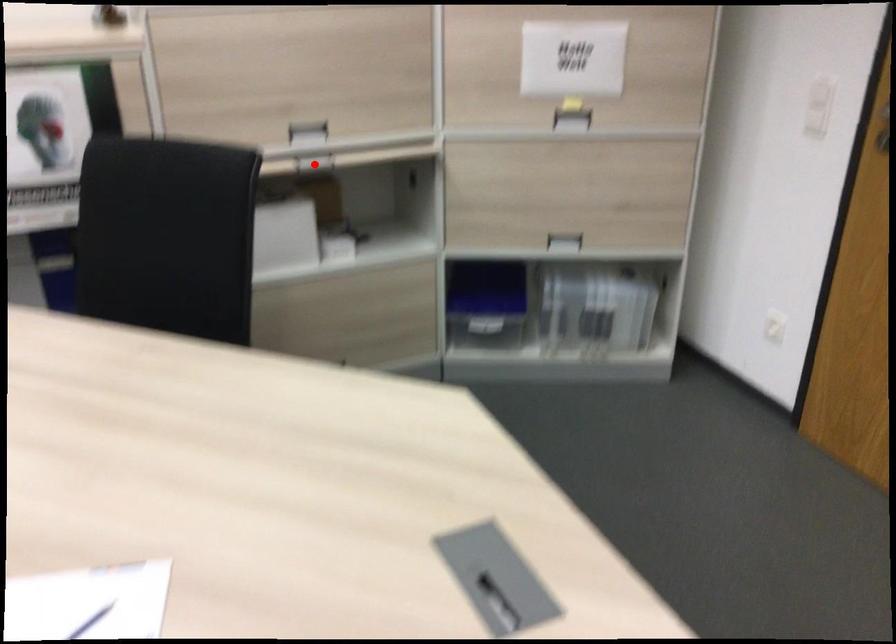
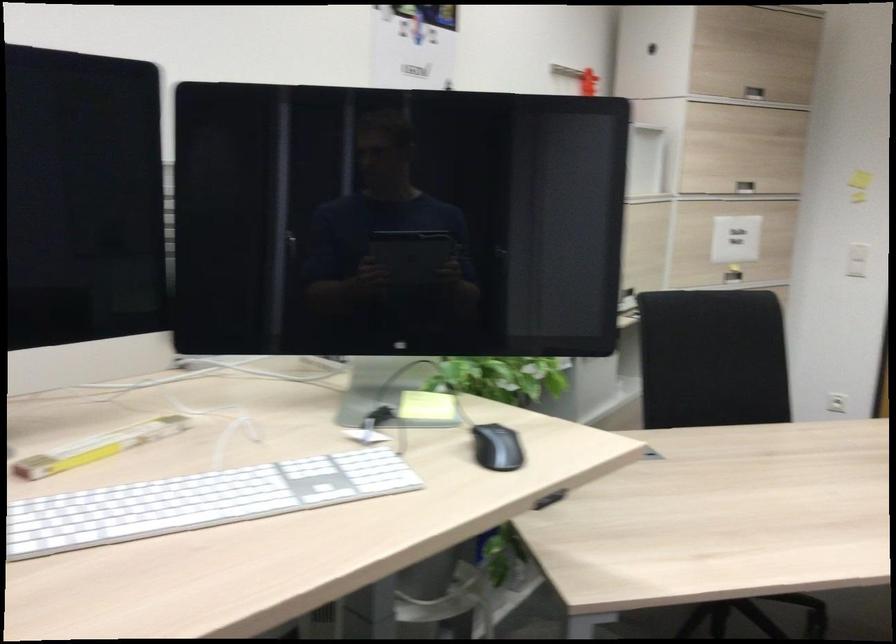
Question: I am providing you with two images of the same scene from different viewpoints. A red point is marked on the first image. Can you still see the location of the red point in image 2?

Choices:
 (A) Yes
 (B) No

Answer: (B)